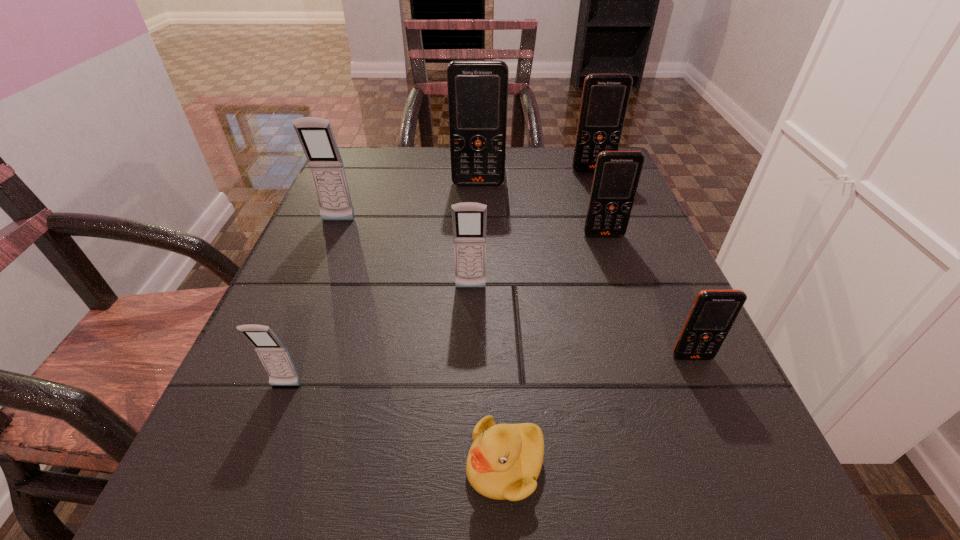
Where is `vacant space that satisfies the following two spatial constraints: 1. on the screen of the farthest cellular telephone; 2. on the front-facing side of the nearest object`? Image resolution: width=960 pixels, height=540 pixels. vacant space that satisfies the following two spatial constraints: 1. on the screen of the farthest cellular telephone; 2. on the front-facing side of the nearest object is located at coordinates (707, 465).